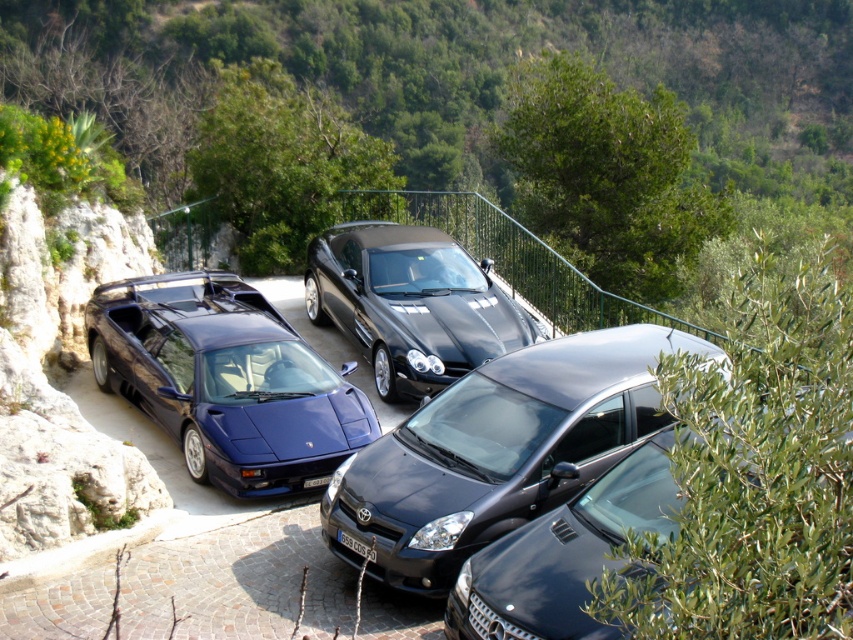
You are a photographer standing at the camera position. You want to take a photo of the metallic blue sports car at left. If your camera has a maximum focus range of 10 meters, will you be able to capture it clearly?

The metallic blue sports car at left is 9.27 meters away from the camera. Since the camera can focus up to 10 meters, it is within the range, so yes, you can capture it clearly.

Consider the image. You are a delivery person trying to park your van behind the satin black hatchback at center and the glossy black sedan at center. Which car should you park behind so that your van can fit in the space between them?

You should park behind the glossy black sedan at center because the satin black hatchback at center is in front of it, creating a space between them where your van can fit.

Based on the photo, you are a parking attendant who needs to fit both the satin black hatchback at center and the glossy black sedan at center into a parking spot that is 2.5 meters wide. Based on their widths, which car should be placed first to ensure both fit?

The satin black hatchback at center is wider than the glossy black sedan at center. To fit both into the 2.5 meters wide parking spot, place the wider satin black hatchback at center first, then the narrower glossy black sedan at center, ensuring their combined width does not exceed the available space.